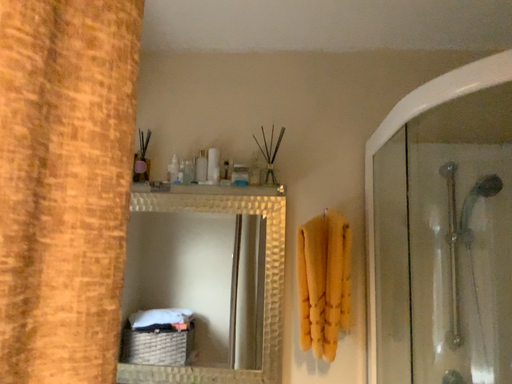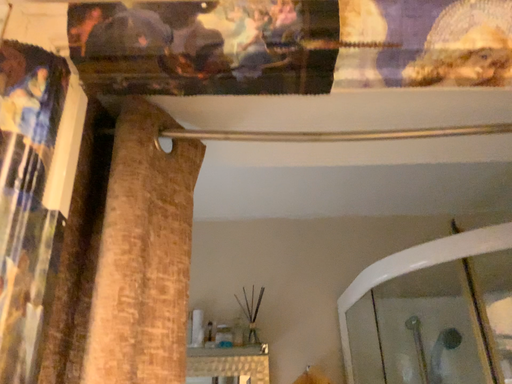
Question: How did the camera likely rotate when shooting the video?

Choices:
 (A) rotated upward
 (B) rotated downward

Answer: (A)